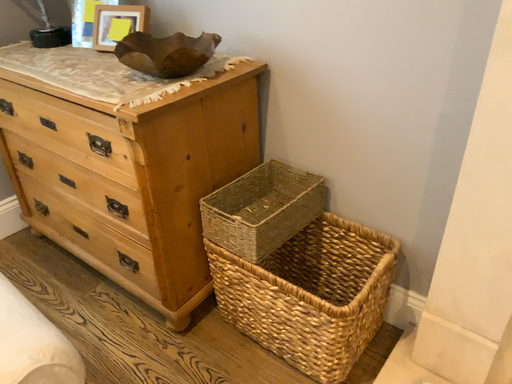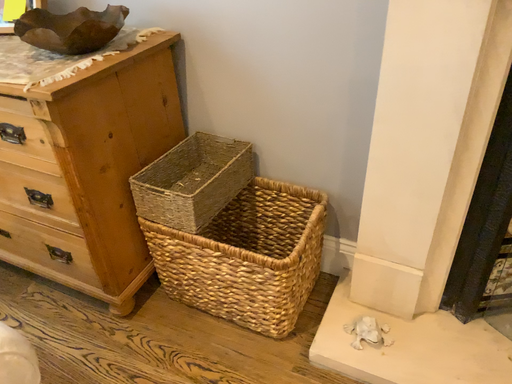
Question: Which way did the camera rotate in the video?

Choices:
 (A) rotated right
 (B) rotated left

Answer: (A)